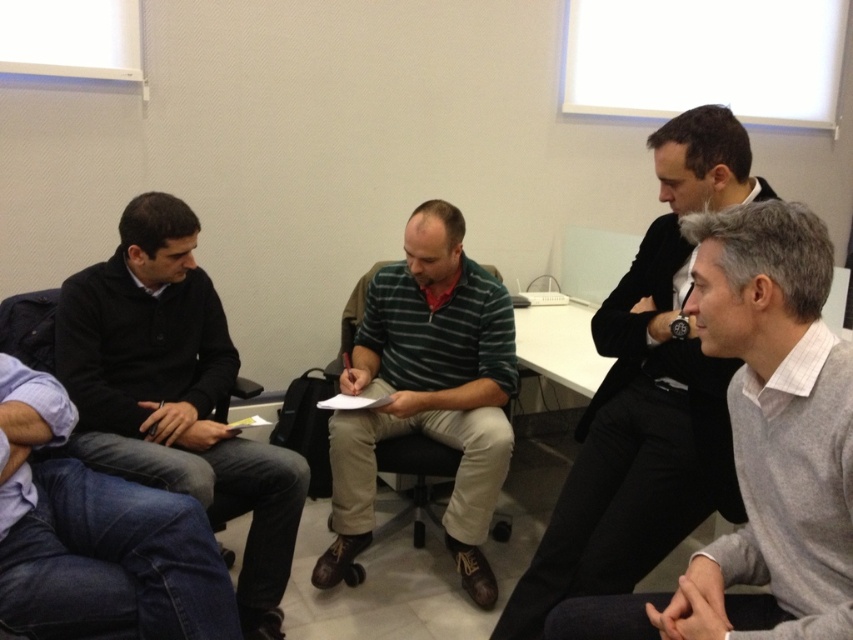
In the scene shown: Can you confirm if dark gray suit at right is positioned below dark gray sweater at left?

No, dark gray suit at right is not below dark gray sweater at left.

How distant is dark gray suit at right from dark gray sweater at left?

A distance of 3.41 feet exists between dark gray suit at right and dark gray sweater at left.

Does point (688, 381) come farther from viewer compared to point (204, 486)?

That is False.

What are the coordinates of `dark gray suit at right` in the screenshot? It's located at (647, 397).

What do you see at coordinates (647, 397) in the screenshot? I see `dark gray suit at right` at bounding box center [647, 397].

I want to click on dark gray suit at right, so click(x=647, y=397).

Is dark gray sweater at left thinner than green striped sweater at center?

No.

Is dark gray sweater at left further to the viewer compared to green striped sweater at center?

No, dark gray sweater at left is closer to the viewer.

This screenshot has height=640, width=853. What do you see at coordinates (173, 394) in the screenshot?
I see `dark gray sweater at left` at bounding box center [173, 394].

Find the location of a particular element. This screenshot has height=640, width=853. dark gray sweater at left is located at coordinates (x=173, y=394).